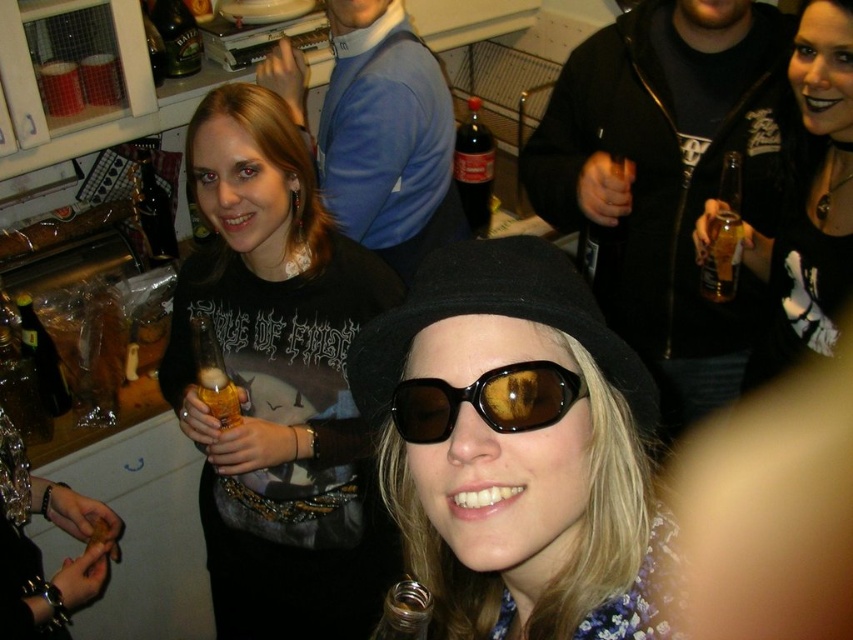
Based on the photo, you are at a party and want to grab the translucent plastic bottle at center. There is a black matte hat at center in the way. Can you reach the bottle without moving the hat?

The black matte hat at center is closer to the viewer than the translucent plastic bottle at center, so you can reach around or behind the hat to grab the bottle without moving it.

You are at a party and want to place the translucent glass beer bottle at center on a shelf that can only hold items narrower than the matte black shirt at center. Can the bottle fit?

The translucent glass beer bottle at center is narrower than the matte black shirt at center, so it can fit on the shelf.